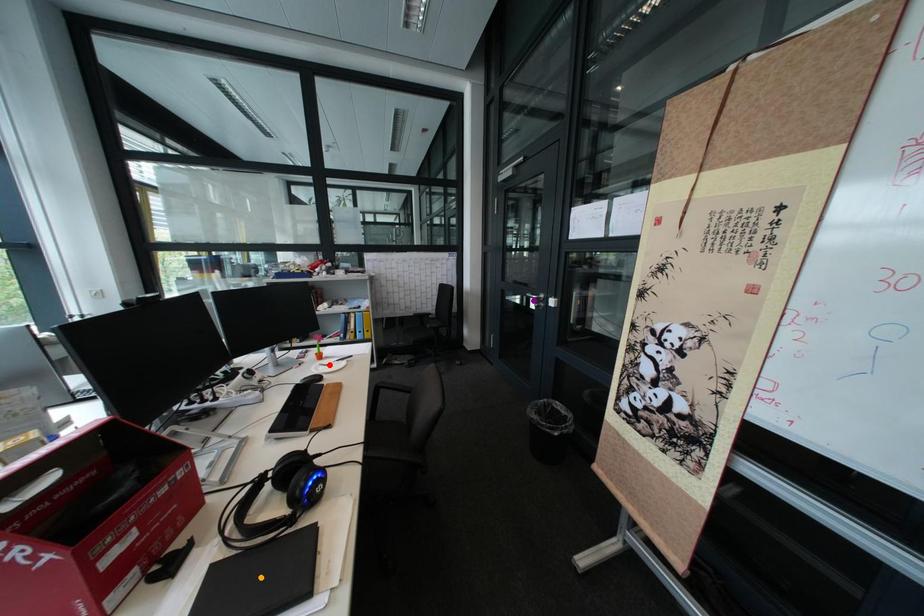
Order these from nearest to farthest:
A) purple point
B) red point
C) orange point

orange point → red point → purple point